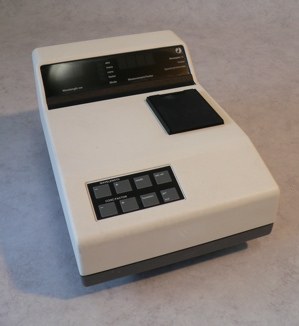
Find the location of a particular element. screen is located at coordinates (128, 67).